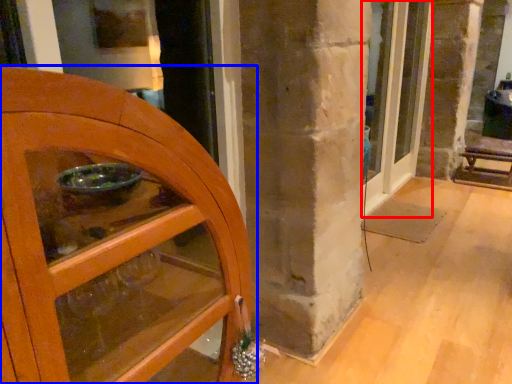
Question: Which object is further to the camera taking this photo, door (highlighted by a red box) or door (highlighted by a blue box)?

Choices:
 (A) door
 (B) door

Answer: (A)